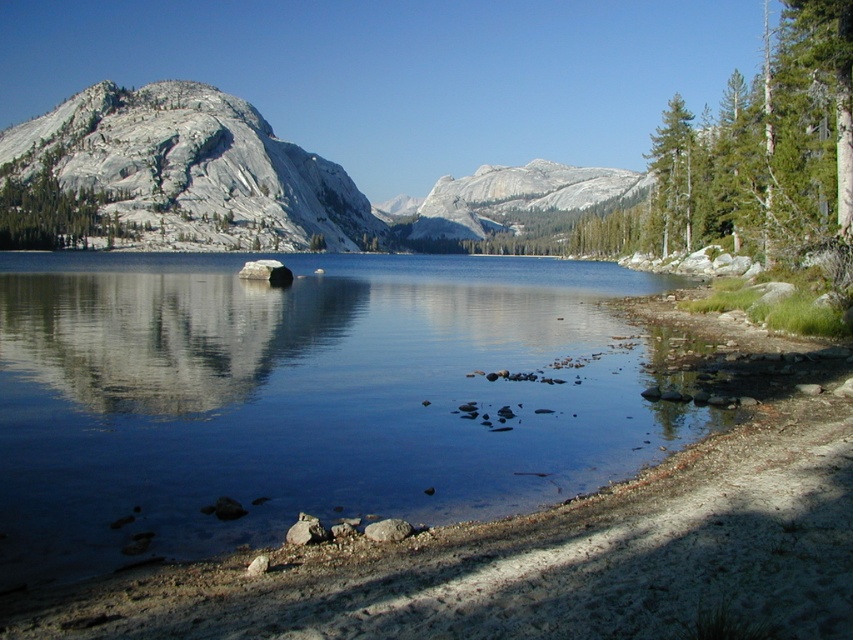
You are standing at the lakeshore and want to take a photo of both the granite mountain at upper left and the granite mountain at center. Which mountain should you position closer to the camera to include both in the frame?

The granite mountain at upper left is below the granite mountain at center, so you should position the camera closer to the granite mountain at upper left to ensure both mountains are visible in the frame.

You are an outdoor enthusiast planning to take a photo of the granite mountain at upper left and the smooth gray rock at upper left. Which object should you focus on first if you want to capture both in a single frame without moving the camera?

You should focus on the granite mountain at upper left first because it is taller than the smooth gray rock at upper left, so it will occupy more space in the frame and ensure proper composition.

You are standing at the edge of the lake and notice two points marked in the scene. The first point is at coordinate point(192, 202) and the second is at point(48, 234). Which point is closer to your current position?

Point(192, 202) is further to the camera than point(48, 234), so the second point is closer to your current position.